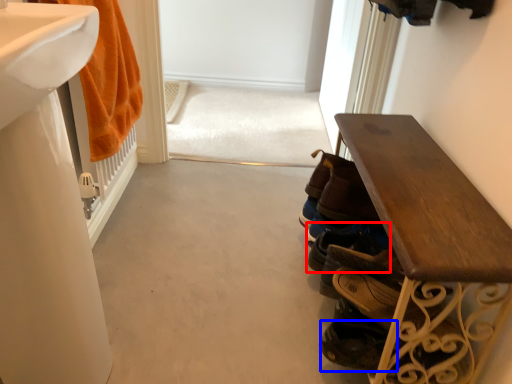
Question: Which point is further to the camera, footwear (highlighted by a red box) or shoe (highlighted by a blue box)?

Choices:
 (A) footwear
 (B) shoe

Answer: (A)